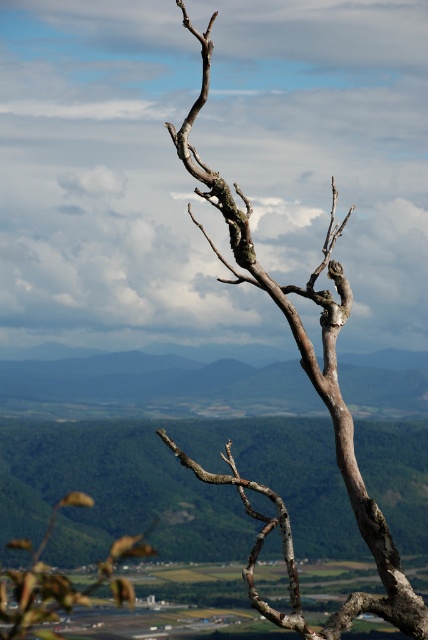
You are standing at the base of the weathered tree branch in the image. Looking towards the point marked at coordinates (152, 387), what do you see in that direction?

In the direction of the point marked at coordinates (152, 387), you see a green grassy plain at center.

You are standing at the base of the tree in the image and want to place a small marker at point A and point B. If point A is at coordinates point (186,385) and point B is at coordinates point (207,84), which point will be closer to you when you look towards the mountains?

Point B at coordinates point (207,84) will be closer to you because it is in front of point A at coordinates point (186,385) according to their positions in the image.